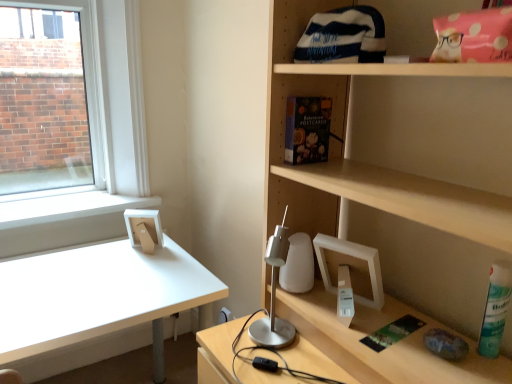
Locate an element on the screen. Image resolution: width=512 pixels, height=384 pixels. empty space that is ontop of white matte desk at left (from a real-world perspective) is located at coordinates (96, 283).